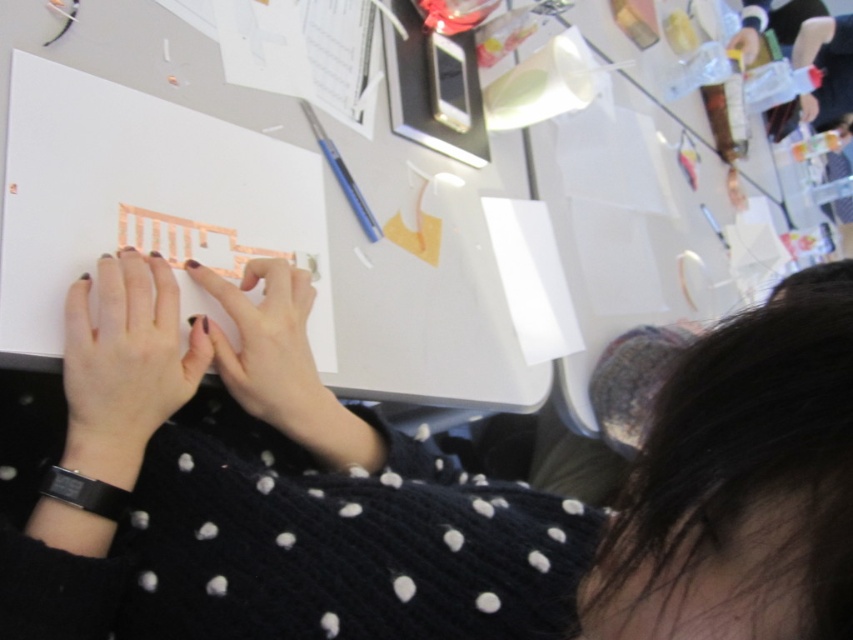
You are organizing a craft kit and need to place the matte pink paper at center and the metallic gold paper at upper center into a storage box. The box has two compartments, one for small items and one for large items. Based on their sizes, which compartment should each paper go into?

The matte pink paper at center has a smaller size compared to metallic gold paper at upper center, so the matte pink paper at center should go into the small items compartment and the metallic gold paper at upper center should go into the large items compartment.

Looking at this image, you are a craft designer who needs to place a new tool on the desk. The tool requires a space that is wider than the nail polish matte hand at center. Is there enough space next to the metallic gold paper at upper center?

The nail polish matte hand at center is thinner than the metallic gold paper at upper center. Since the tool requires a space wider than the nail polish matte hand at center, the metallic gold paper at upper center is wider and can accommodate the tool.

You are a craft assistant who needs to place a sticker exactly at the center of the matte pink paper at center. According to the coordinates provided, where should you place the sticker?

The sticker should be placed at the coordinates point (126, 358) on the matte pink paper at center as specified.